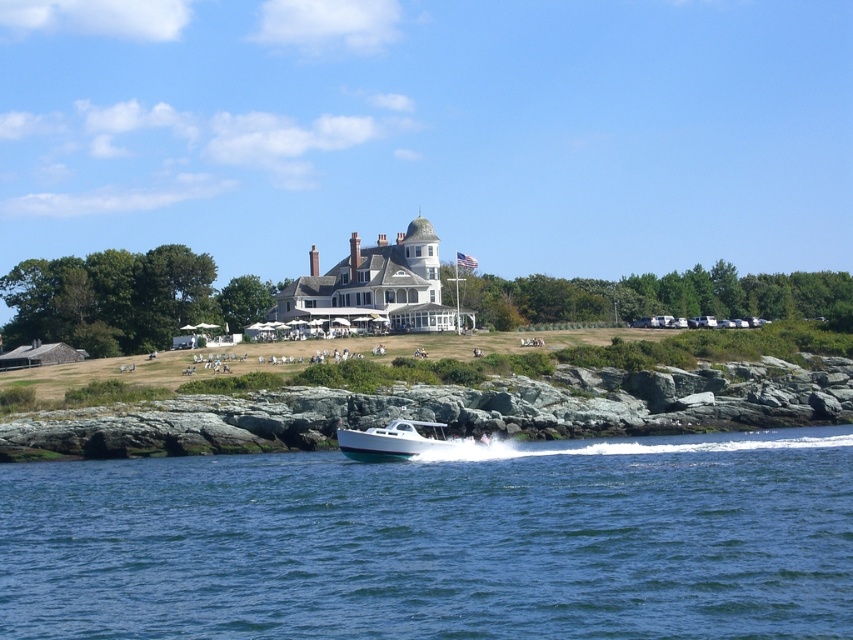
You are standing on the rocky shoreline and want to walk to the white wooden mansion at center. Which direction should you go to move away from the blue water at lower center?

To move away from the blue water at lower center and reach the white wooden mansion at center, you should walk towards the grassy hill in the background since the mansion is further away from the water than the shoreline.

You are standing on the rocky shoreline and see the blue water at lower center and the white glossy boat at center. Which object appears higher in the image?

The blue water at lower center appears higher than the white glossy boat at center because the blue water at lower center is taller than the white glossy boat at center.